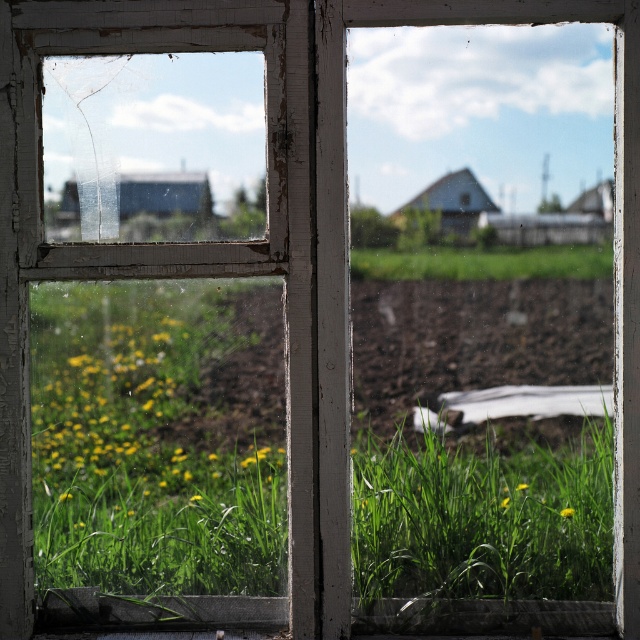
You are a gardener standing in front of the weathered window frame. You notice the smooth concrete sill at lower center and the green grass at center. Which object is located to the left of the other?

The smooth concrete sill at lower center is positioned on the left side of green grass at center.

You are a small insect trying to cross from the smooth concrete sill at lower center to the green grass at center. The distance you can jump is 14 inches. Can you make it across?

The smooth concrete sill at lower center is 14.53 inches away from the green grass at center. Since your maximum jump distance is 14 inches, you cannot reach the green grass at center in a single jump.

Looking at this image, you are standing in a room with an old window. You notice two points marked on the window glass at coordinates point (488,611) and point (588,257). If you want to clean the point that is closer to you, which coordinate should you target?

Point (488,611) is further to the viewer than point (588,257), so to clean the closer point, you should target point (588,257).